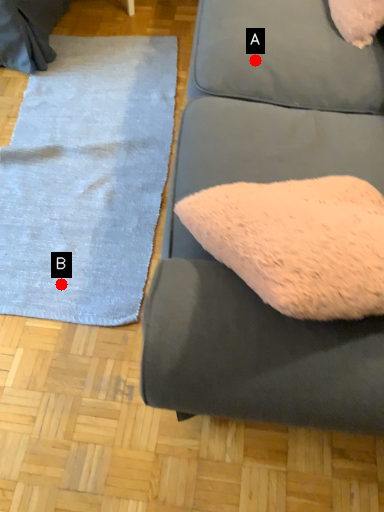
Question: Two points are circled on the image, labeled by A and B beside each circle. Which point appears closest to the camera in this image?

Choices:
 (A) A is closer
 (B) B is closer

Answer: (A)